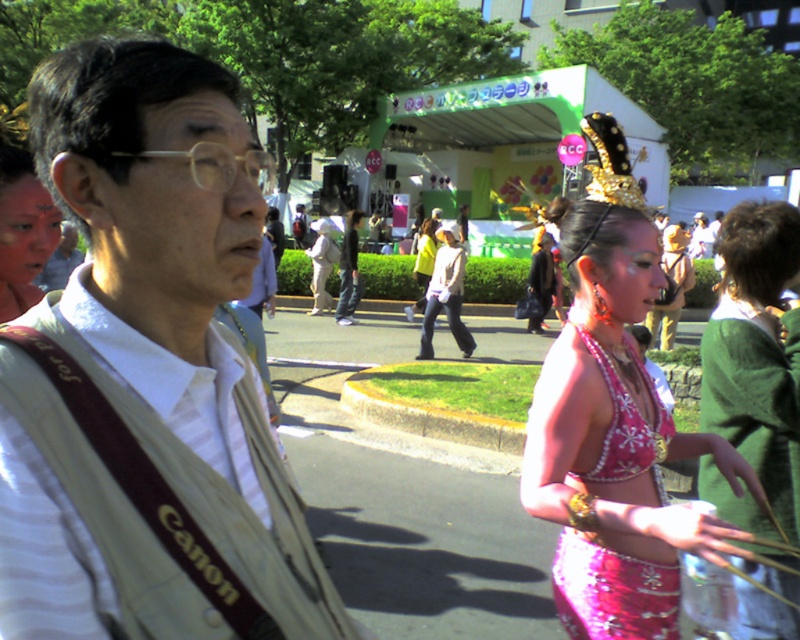
Does white fabric shirt at left have a larger size compared to pink sequined bikini top at center?

No, white fabric shirt at left is not bigger than pink sequined bikini top at center.

Does white fabric shirt at left have a lesser width compared to pink sequined bikini top at center?

No.

Describe the element at coordinates (148, 376) in the screenshot. This screenshot has height=640, width=800. I see `white fabric shirt at left` at that location.

Where is `white fabric shirt at left`? This screenshot has height=640, width=800. white fabric shirt at left is located at coordinates (148, 376).

Does pink sequined skirt at center appear over white cotton shirt at center?

Incorrect, pink sequined skirt at center is not positioned above white cotton shirt at center.

Is the position of pink sequined skirt at center more distant than that of white cotton shirt at center?

No, pink sequined skirt at center is closer to the viewer.

Is point (640, 380) behind point (462, 275)?

No, (640, 380) is in front of (462, 275).

You are a GUI agent. You are given a task and a screenshot of the screen. Output one action in this format:
    pyautogui.click(x=<x>, y=<y>)
    Task: Click on the pink sequined skirt at center
    This screenshot has height=640, width=800.
    Given the screenshot: What is the action you would take?
    pyautogui.click(x=614, y=442)

Who is positioned more to the left, white fabric shirt at left or pink sequined skirt at center?

white fabric shirt at left is more to the left.

Is point (110, 534) less distant than point (750, 538)?

That is True.

Where is `white fabric shirt at left`? white fabric shirt at left is located at coordinates (148, 376).

Locate an element on the screen. This screenshot has height=640, width=800. white fabric shirt at left is located at coordinates (148, 376).